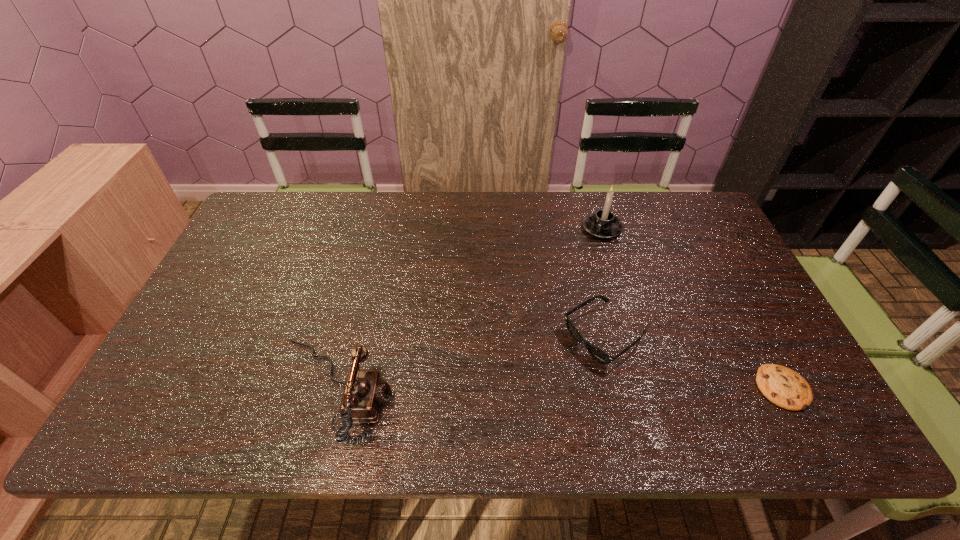
This screenshot has width=960, height=540. I want to click on telephone, so click(x=365, y=390).

Where is `the leftmost object`? The height and width of the screenshot is (540, 960). the leftmost object is located at coordinates (365, 390).

The height and width of the screenshot is (540, 960). I want to click on the shortest object, so click(x=782, y=386).

You are a GUI agent. You are given a task and a screenshot of the screen. Output one action in this format:
    pyautogui.click(x=<x>, y=<y>)
    Task: Click on the cookie
    Image resolution: width=960 pixels, height=540 pixels.
    Given the screenshot: What is the action you would take?
    pyautogui.click(x=782, y=386)

Locate an element on the screen. The width and height of the screenshot is (960, 540). sunglasses is located at coordinates (598, 354).

Identify the location of candle holder. (603, 224).

The width and height of the screenshot is (960, 540). I want to click on the tallest object, so [603, 224].

At what (x,y) coordinates should I click in order to perform the action: click on free space located on the dial of the second tallest object. Please return your answer as a coordinate pair (x, y). Looking at the image, I should click on (425, 390).

Identify the location of vacant space located 0.260m on the left of the cookie. The width and height of the screenshot is (960, 540). (646, 388).

In order to click on vacant space located 0.100m on the front-facing side of the second shortest object in this screenshot , I will do `click(544, 377)`.